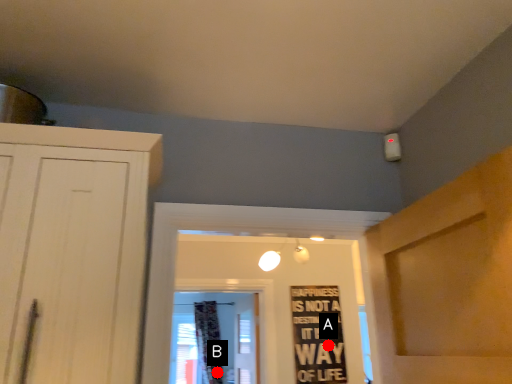
Question: Two points are circled on the image, labeled by A and B beside each circle. Which of the following is the farthest from the observer?

Choices:
 (A) A is further
 (B) B is further

Answer: (B)